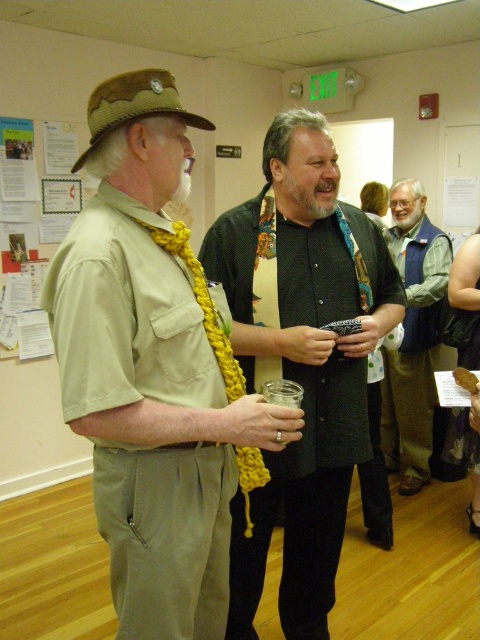
Question: Which object is closer to the camera taking this photo?

Choices:
 (A) black matte shirt at center
 (B) blue-green vest at center-right

Answer: (A)

Question: Which object is farther from the camera taking this photo?

Choices:
 (A) matte khaki shirt at left
 (B) blue-green vest at center-right
 (C) black matte shirt at center

Answer: (B)

Question: Considering the relative positions of matte khaki shirt at left and black matte shirt at center in the image provided, where is matte khaki shirt at left located with respect to black matte shirt at center?

Choices:
 (A) above
 (B) below

Answer: (A)

Question: Does matte khaki shirt at left have a smaller size compared to blue-green vest at center-right?

Choices:
 (A) no
 (B) yes

Answer: (B)

Question: Which point is farther to the camera?

Choices:
 (A) matte khaki shirt at left
 (B) black matte shirt at center
 (C) blue-green vest at center-right

Answer: (C)

Question: Does matte khaki shirt at left appear under black matte shirt at center?

Choices:
 (A) yes
 (B) no

Answer: (B)